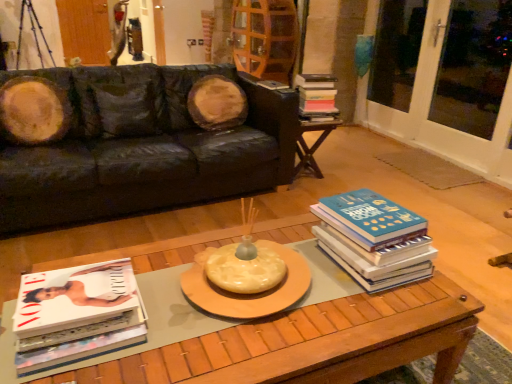
Question: From the image's perspective, does black leather couch at upper left appear lower than wooden coffee table at center?

Choices:
 (A) yes
 (B) no

Answer: (B)

Question: Would you say wooden coffee table at center is part of black leather couch at upper left's contents?

Choices:
 (A) yes
 (B) no

Answer: (B)

Question: From a real-world perspective, does black leather couch at upper left stand above wooden coffee table at center?

Choices:
 (A) yes
 (B) no

Answer: (A)

Question: Is black leather couch at upper left at the right side of wooden coffee table at center?

Choices:
 (A) no
 (B) yes

Answer: (A)

Question: Is black leather couch at upper left wider than wooden coffee table at center?

Choices:
 (A) yes
 (B) no

Answer: (A)

Question: Would you say black leather couch at upper left is a long distance from wooden coffee table at center?

Choices:
 (A) no
 (B) yes

Answer: (B)

Question: Is blue hardcover book at right, which is the 2th book in left-to-right order, closer to camera compared to wooden side table at right?

Choices:
 (A) yes
 (B) no

Answer: (A)

Question: Is wooden side table at right surrounded by blue hardcover book at right, which is counted as the 2th book, starting from the bottom?

Choices:
 (A) yes
 (B) no

Answer: (B)

Question: Is blue hardcover book at right, which is the 2th book from back to front, aimed at wooden side table at right?

Choices:
 (A) yes
 (B) no

Answer: (A)

Question: Does blue hardcover book at right, the 2th book positioned from the right, have a lesser width compared to wooden side table at right?

Choices:
 (A) no
 (B) yes

Answer: (B)

Question: From a real-world perspective, is blue hardcover book at right, which is the 2th book in left-to-right order, positioned under wooden side table at right based on gravity?

Choices:
 (A) no
 (B) yes

Answer: (A)

Question: From the image's perspective, is blue hardcover book at right, which is counted as the 2th book, starting from the top, on top of wooden side table at right?

Choices:
 (A) yes
 (B) no

Answer: (B)

Question: Is white glass screen door at right, acting as the 2th screen door starting from the top, far from black leather couch at upper left?

Choices:
 (A) yes
 (B) no

Answer: (A)